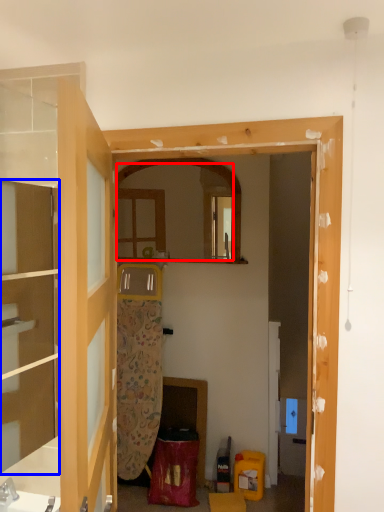
Question: Which of the following is the closest to the observer, mirror (highlighted by a red box) or cabinetry (highlighted by a blue box)?

Choices:
 (A) mirror
 (B) cabinetry

Answer: (B)